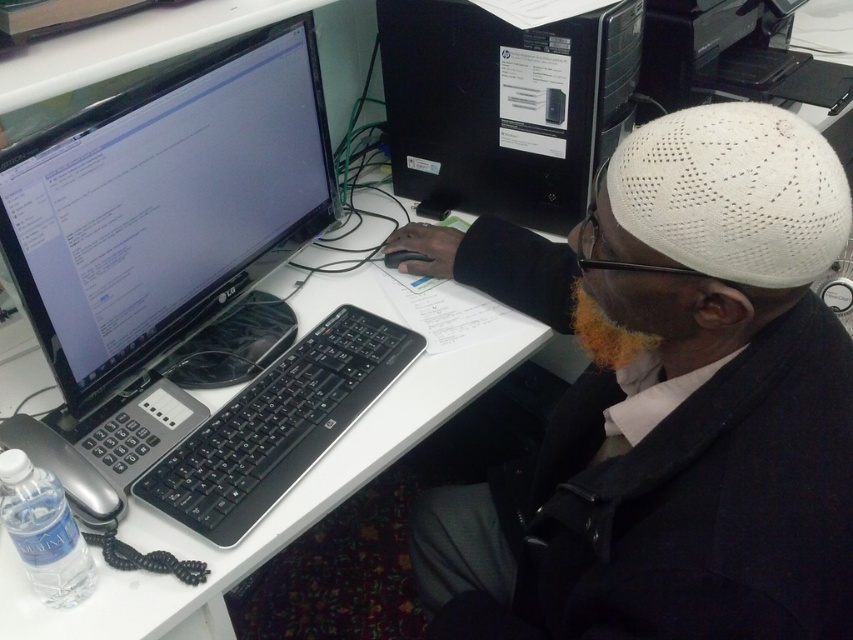
Is white knit cap at upper right taller than black glossy monitor at upper left?

Correct, white knit cap at upper right is much taller as black glossy monitor at upper left.

Is white knit cap at upper right behind black glossy monitor at upper left?

No.

Who is more distant from viewer, (815, 563) or (252, 177)?

Point (252, 177)

At what (x,y) coordinates should I click in order to perform the action: click on white knit cap at upper right. Please return your answer as a coordinate pair (x, y). This screenshot has width=853, height=640. Looking at the image, I should click on (666, 401).

Between point (763, 609) and point (438, 81), which one is positioned in front?

Positioned in front is point (763, 609).

Does white knit cap at upper right come behind black plastic computer tower at center?

No, white knit cap at upper right is in front of black plastic computer tower at center.

Who is more distant from viewer, (x=401, y=230) or (x=527, y=211)?

The point (x=527, y=211) is more distant.

Where is `white knit cap at upper right`? The width and height of the screenshot is (853, 640). white knit cap at upper right is located at coordinates (666, 401).

The image size is (853, 640). What do you see at coordinates (165, 204) in the screenshot?
I see `black glossy monitor at upper left` at bounding box center [165, 204].

Find the location of a particular element. black glossy monitor at upper left is located at coordinates (165, 204).

Where is `black glossy monitor at upper left`? Image resolution: width=853 pixels, height=640 pixels. black glossy monitor at upper left is located at coordinates (165, 204).